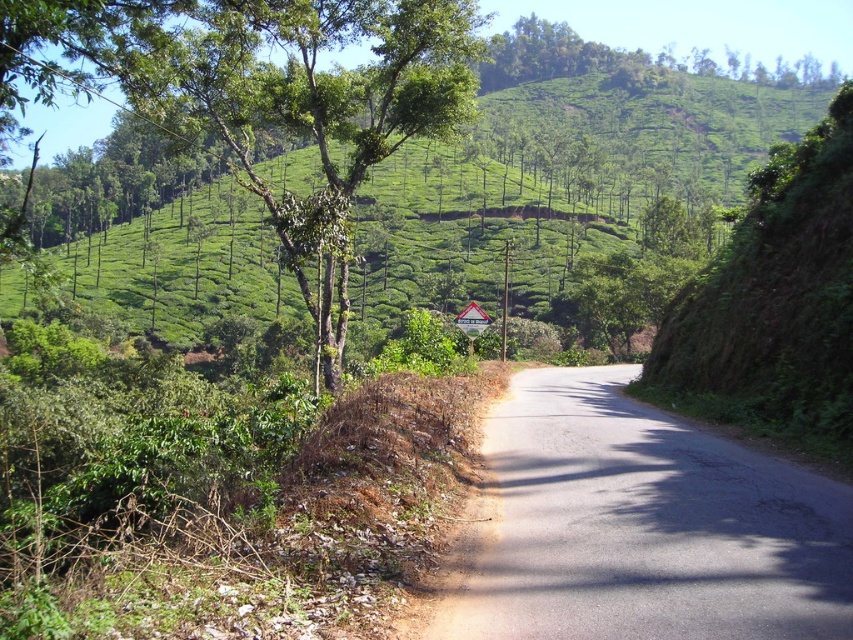
In the scene shown: Is asphalt road at center bigger than green leafy tree at upper center?

No, asphalt road at center is not bigger than green leafy tree at upper center.

Is asphalt road at center above green leafy tree at upper center?

No, asphalt road at center is not above green leafy tree at upper center.

Between point (647, 614) and point (192, 8), which one is positioned in front?

Point (647, 614)

At what (x,y) coordinates should I click in order to perform the action: click on asphalt road at center. Please return your answer as a coordinate pair (x, y). Looking at the image, I should click on (641, 525).